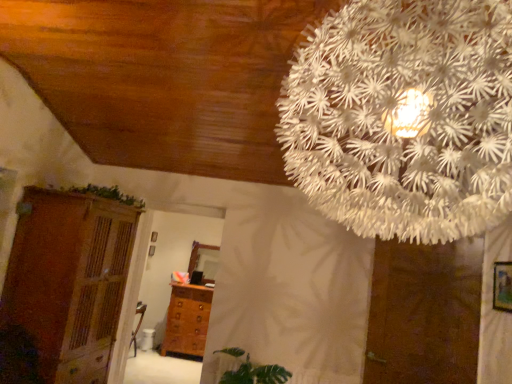
Question: Is brown wooden dresser at left spatially inside wooden chest of drawers at center, or outside of it?

Choices:
 (A) inside
 (B) outside

Answer: (B)

Question: Considering the positions of brown wooden dresser at left and wooden chest of drawers at center in the image, is brown wooden dresser at left wider or thinner than wooden chest of drawers at center?

Choices:
 (A) wide
 (B) thin

Answer: (A)

Question: Considering the real-world distances, which object is farthest from the green leafy plant at lower center?

Choices:
 (A) white paper flower at upper center
 (B) wooden chest of drawers at center
 (C) wooden picture frame at right
 (D) green leafy plant at upper left
 (E) brown wooden dresser at left

Answer: (A)

Question: Which of these objects is positioned closest to the green leafy plant at upper left?

Choices:
 (A) white paper flower at upper center
 (B) wooden chest of drawers at center
 (C) wooden picture frame at right
 (D) brown matte door at lower right
 (E) green leafy plant at lower center

Answer: (E)